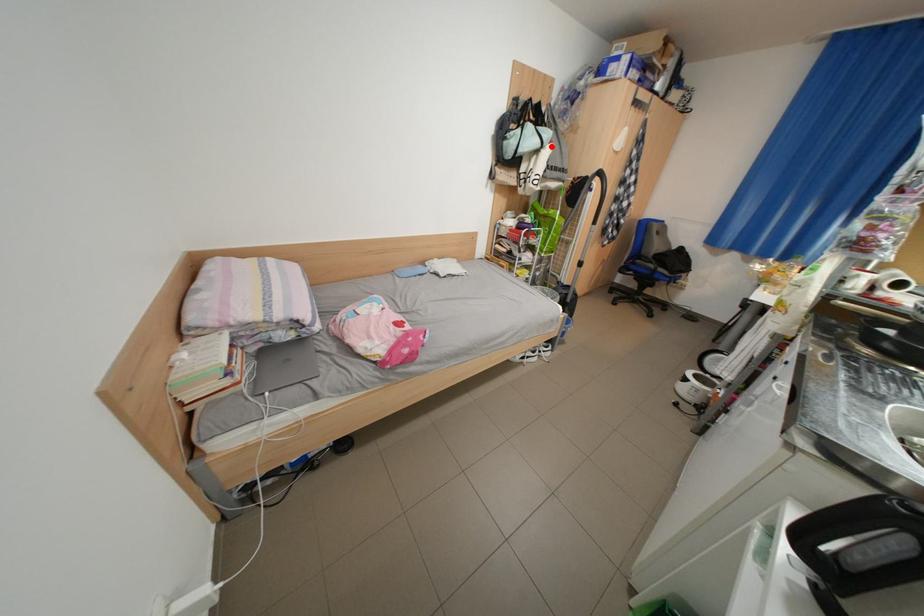
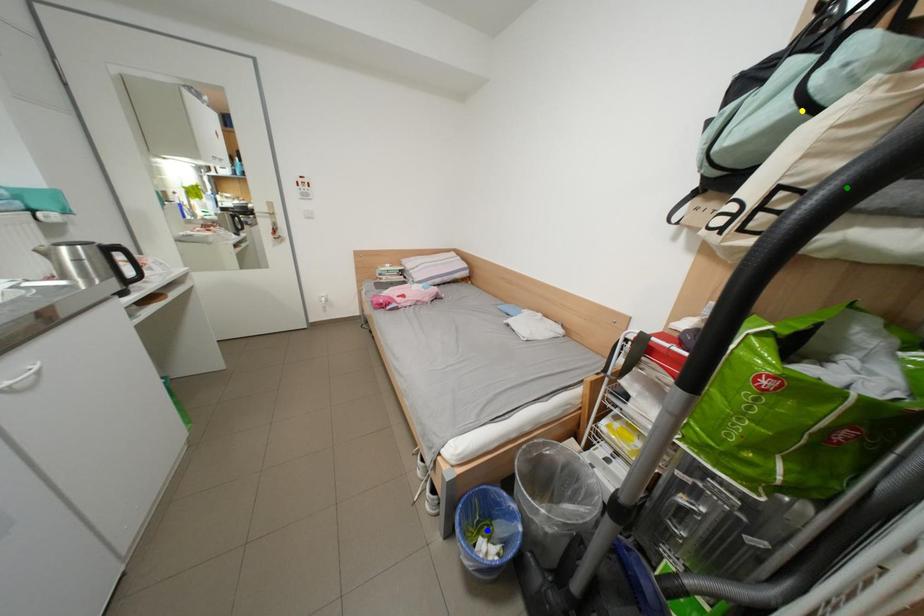
Question: I am providing you with two images of the same scene from different viewpoints. A red point is marked on the first image. You are given multiple points on the second image. In image 2, which mark is for the same physical point as the one in image 1?

Choices:
 (A) green point
 (B) yellow point
 (C) blue point

Answer: (B)